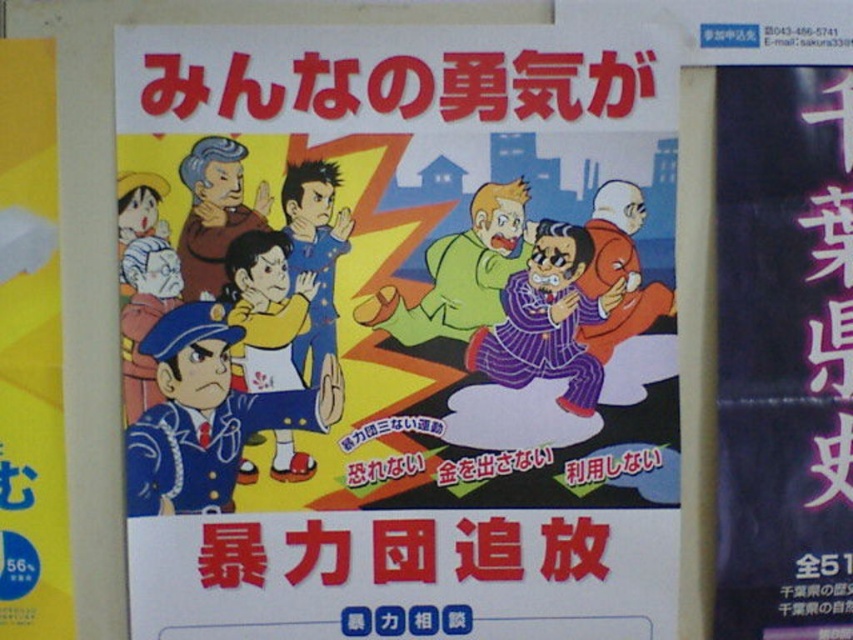
Question: Which object is closer to the camera taking this photo?

Choices:
 (A) matte cartoon poster at center
 (B) black paper at upper right
 (C) yellow paper at left

Answer: (A)

Question: Does black paper at upper right have a greater width compared to yellow paper at left?

Choices:
 (A) no
 (B) yes

Answer: (B)

Question: Is matte cartoon poster at center behind black paper at upper right?

Choices:
 (A) no
 (B) yes

Answer: (A)

Question: Considering the real-world distances, which object is closest to the black paper at upper right?

Choices:
 (A) matte cartoon poster at center
 (B) yellow paper at left

Answer: (A)

Question: Which point is closer to the camera?

Choices:
 (A) yellow paper at left
 (B) matte cartoon poster at center

Answer: (B)

Question: Observing the image, what is the correct spatial positioning of matte cartoon poster at center in reference to yellow paper at left?

Choices:
 (A) below
 (B) above

Answer: (B)